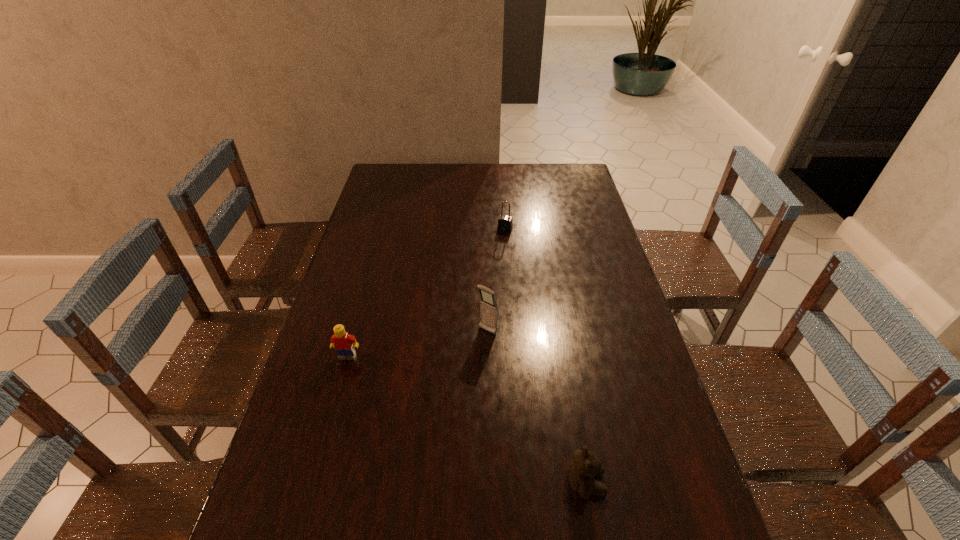
This screenshot has height=540, width=960. Find the location of `free space on the desktop that is between the Lego and the teddy bear and is positioned on the shackle of the farthest object`. free space on the desktop that is between the Lego and the teddy bear and is positioned on the shackle of the farthest object is located at coordinates (432, 401).

Find the location of a particular element. Image resolution: width=960 pixels, height=540 pixels. vacant space on the desktop that is between the leftmost object and the teddy bear and is positioned on the front-facing side of the third object from right to left is located at coordinates (429, 400).